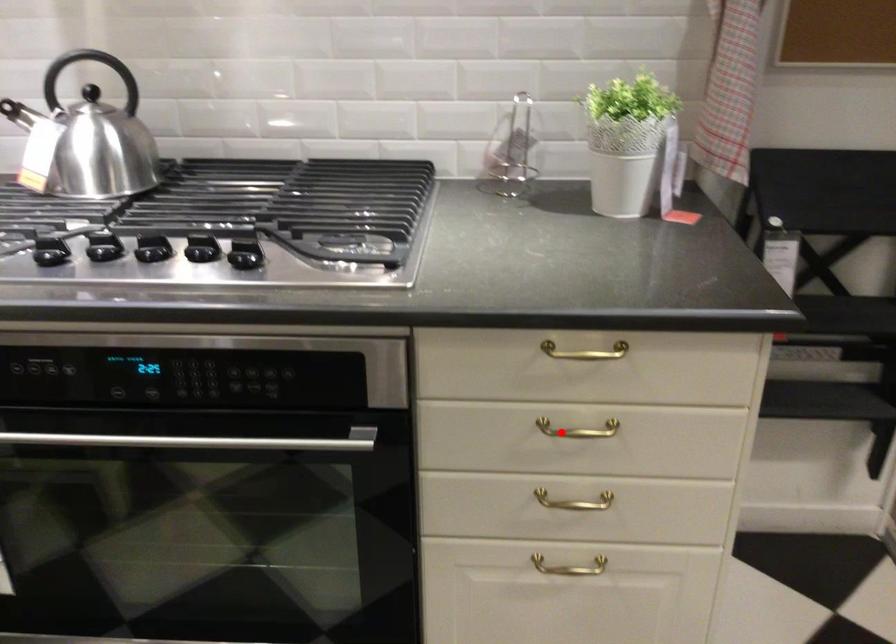
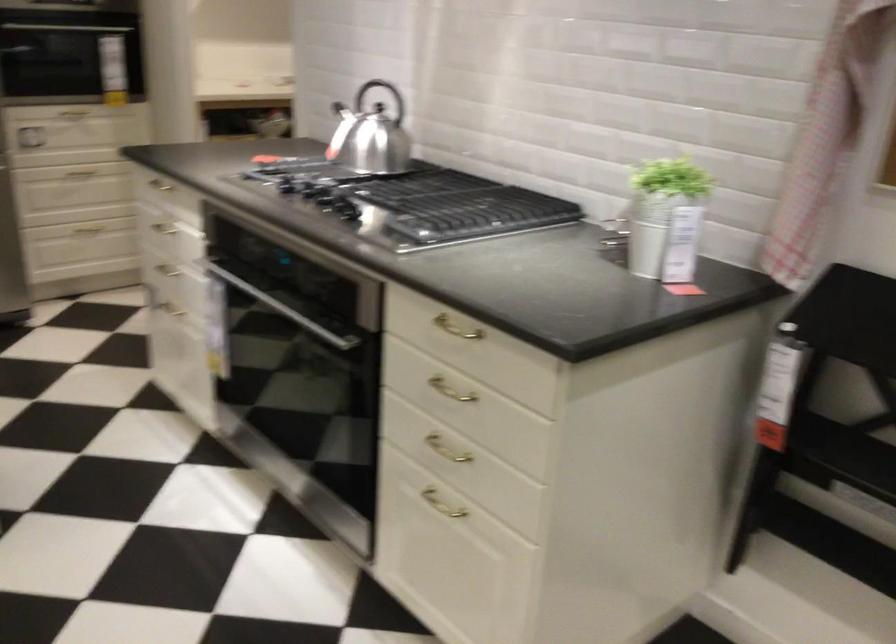
Locate, in the second image, the point that corresponds to the highlighted location in the first image.

(450, 390)